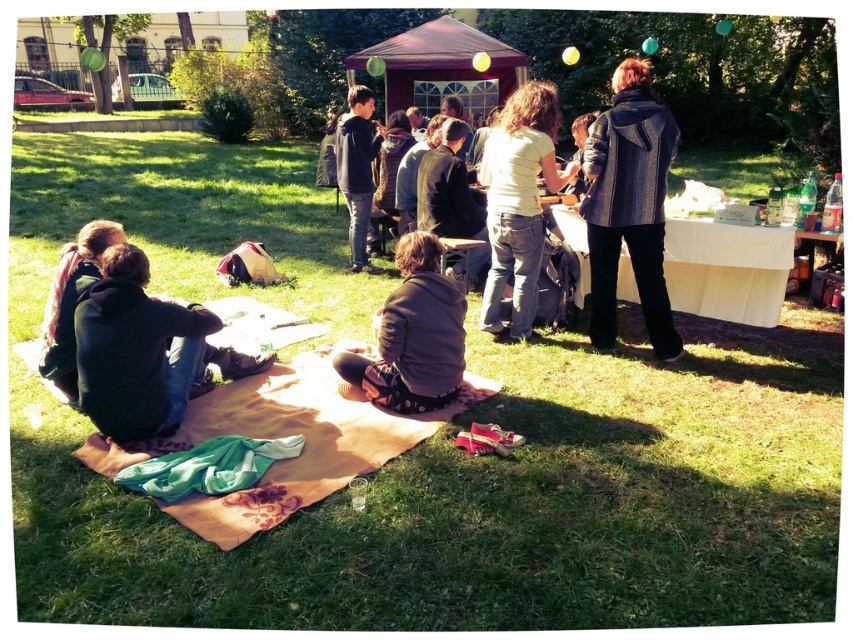
Which is behind, point (532, 260) or point (370, 392)?

The point (532, 260) is more distant.

Can you confirm if white matte shirt at center is positioned to the left of brown fuzzy jacket at center?

Incorrect, white matte shirt at center is not on the left side of brown fuzzy jacket at center.

Is point (524, 124) behind point (440, 310)?

Yes, it is.

The height and width of the screenshot is (640, 853). Identify the location of white matte shirt at center. (518, 202).

What do you see at coordinates (285, 435) in the screenshot?
I see `beige floral blanket at lower center` at bounding box center [285, 435].

Looking at this image, can you confirm if beige floral blanket at lower center is positioned to the left of brown fuzzy jacket at center?

Indeed, beige floral blanket at lower center is positioned on the left side of brown fuzzy jacket at center.

At what (x,y) coordinates should I click in order to perform the action: click on beige floral blanket at lower center. Please return your answer as a coordinate pair (x, y). Looking at the image, I should click on (285, 435).

Which is more to the left, white matte shirt at center or dark brown sweater at lower left?

dark brown sweater at lower left is more to the left.

I want to click on white matte shirt at center, so click(518, 202).

Locate an element on the screen. The width and height of the screenshot is (853, 640). white matte shirt at center is located at coordinates (518, 202).

Identify the location of white matte shirt at center. The width and height of the screenshot is (853, 640). (518, 202).